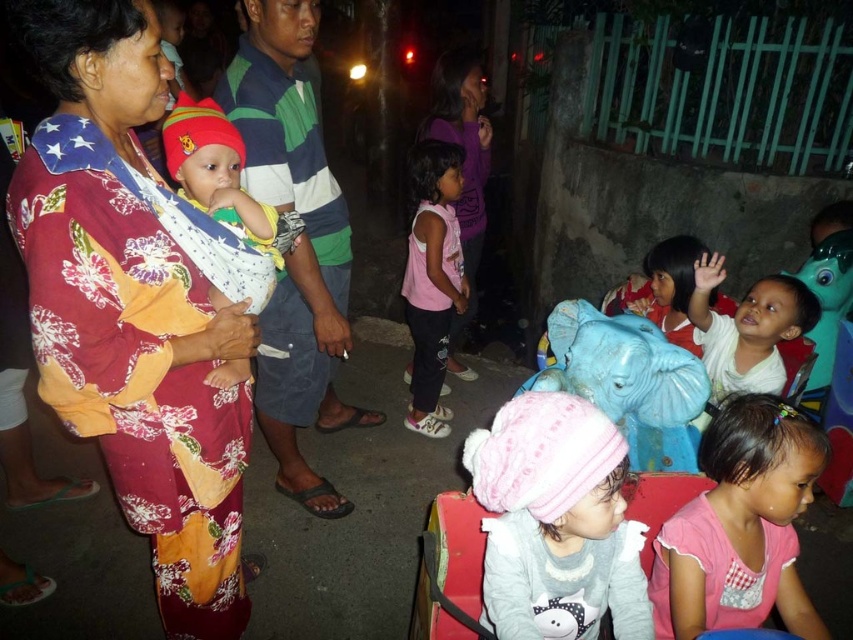
Is point (457, 189) farther from viewer compared to point (704, 276)?

Yes.

Is point (459, 285) positioned in front of point (704, 298)?

No, it is not.

Does point (445, 324) come in front of point (704, 262)?

No, (445, 324) is behind (704, 262).

You are a GUI agent. You are given a task and a screenshot of the screen. Output one action in this format:
    pyautogui.click(x=<x>, y=<y>)
    Task: Click on the pink matte shirt at center
    The height and width of the screenshot is (640, 853).
    Given the screenshot: What is the action you would take?
    pyautogui.click(x=432, y=278)

Is point (701, 536) positioned before point (689, 332)?

Yes, it is in front of point (689, 332).

Does pink fabric shirt at lower right have a larger size compared to matte blue elephant at center?

Incorrect, pink fabric shirt at lower right is not larger than matte blue elephant at center.

Who is more distant from viewer, (808, 464) or (650, 259)?

The point (650, 259) is behind.

Where is `pink fabric shirt at lower right`? Image resolution: width=853 pixels, height=640 pixels. pink fabric shirt at lower right is located at coordinates (741, 525).

Who is higher up, floral fabric woman at center or soft white baby at center?

soft white baby at center is higher up.

Is floral fabric woman at center taller than soft white baby at center?

Yes.

Where is `floral fabric woman at center`? This screenshot has height=640, width=853. floral fabric woman at center is located at coordinates coord(132,305).

Where is `floral fabric woman at center`? This screenshot has width=853, height=640. floral fabric woman at center is located at coordinates (132, 305).